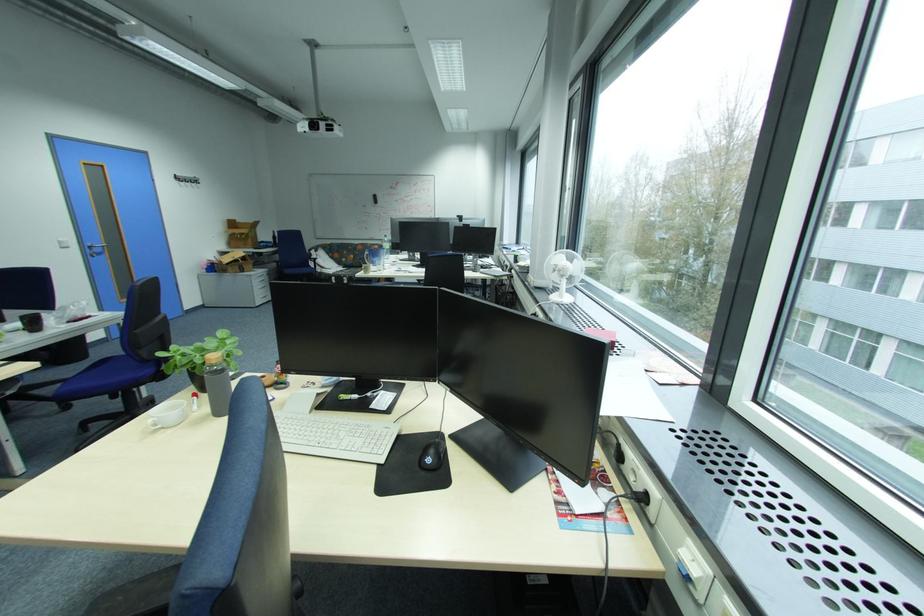
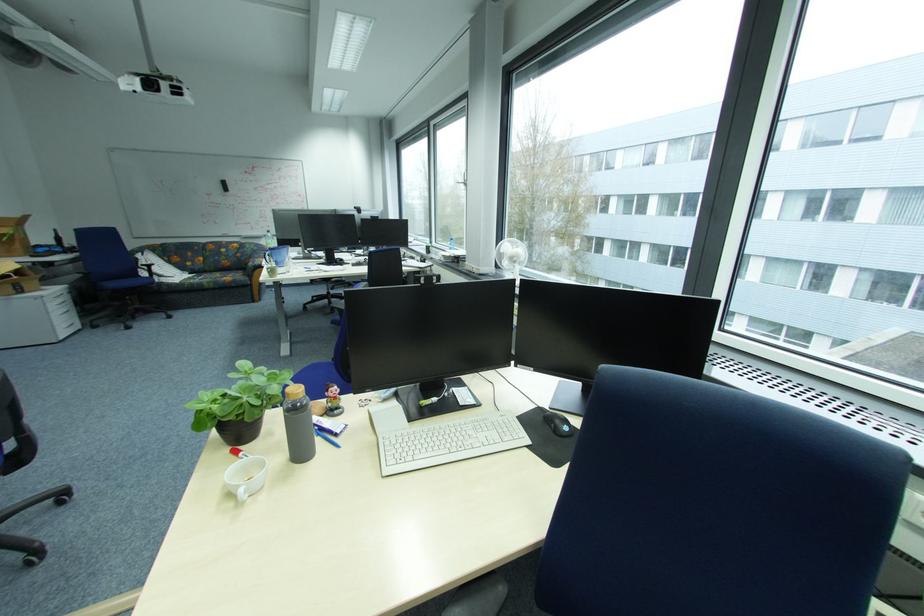
Where in the second image is the point corresponding to the point at 274,298 from the first image?

(80, 326)